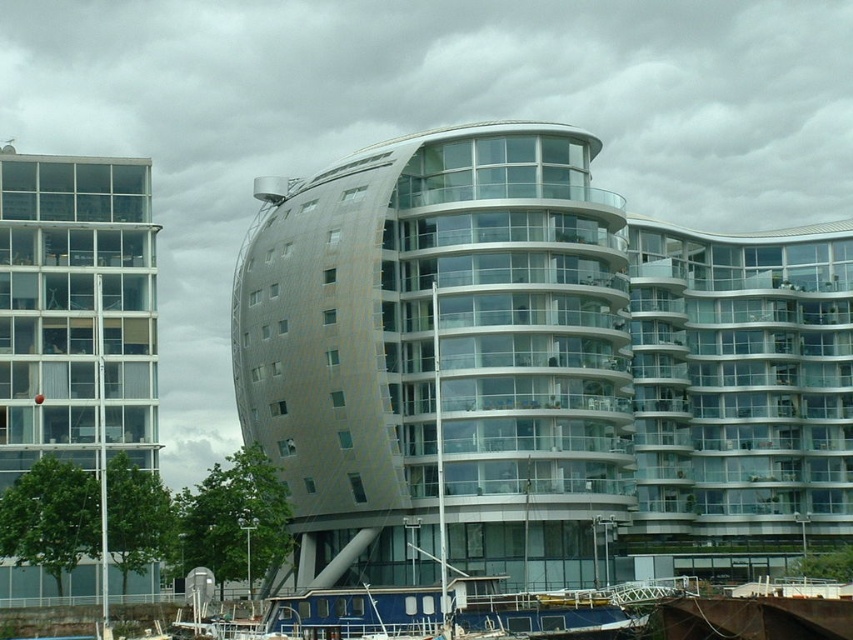
Is sleek metallic building at center thinner than clear glass building at left?

No, sleek metallic building at center is not thinner than clear glass building at left.

Between sleek metallic building at center and clear glass building at left, which one has more height?

sleek metallic building at center is taller.

Measure the distance between point (370, 177) and camera.

A distance of 286.59 feet exists between point (370, 177) and camera.

Image resolution: width=853 pixels, height=640 pixels. In order to click on sleek metallic building at center in this screenshot , I will do `click(537, 371)`.